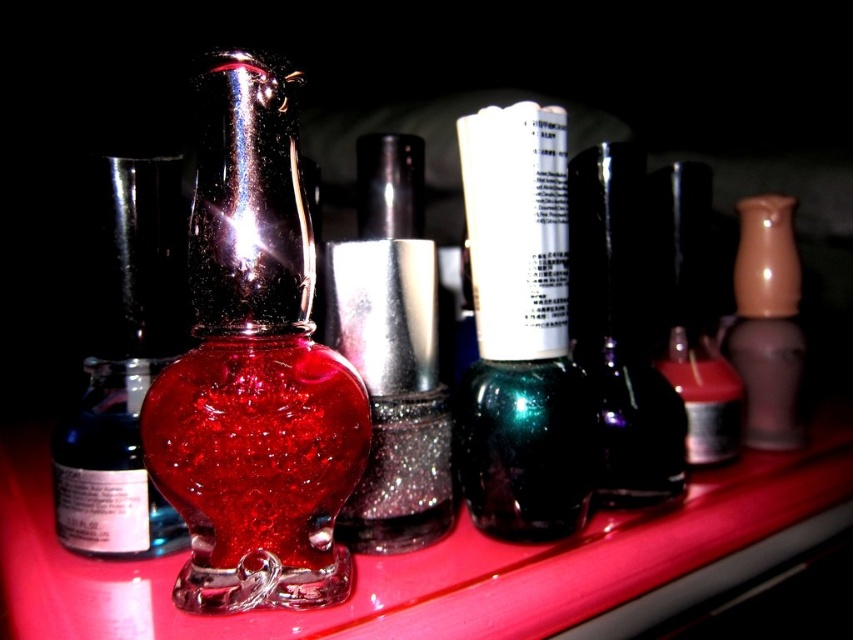
Can you confirm if sparkling glass bottle at center is wider than matte brown vase at right?

Yes.

Can you confirm if sparkling glass bottle at center is thinner than matte brown vase at right?

No.

Which is behind, point (213, 141) or point (735, 273)?

The point (735, 273) is behind.

Where is `sparkling glass bottle at center`? The height and width of the screenshot is (640, 853). sparkling glass bottle at center is located at coordinates (254, 365).

Can you confirm if shiny metallic nail polish at center is positioned to the left of matte black nail polish at center?

Correct, you'll find shiny metallic nail polish at center to the left of matte black nail polish at center.

Measure the distance from shiny metallic nail polish at center to matte black nail polish at center.

shiny metallic nail polish at center is 11.49 inches away from matte black nail polish at center.

Is point (410, 524) closer to viewer compared to point (738, 422)?

Yes, point (410, 524) is in front of point (738, 422).

This screenshot has width=853, height=640. In order to click on shiny metallic nail polish at center in this screenshot , I will do `click(392, 353)`.

Which is above, green metallic nail polish at center or matte brown vase at right?

matte brown vase at right

Can you confirm if green metallic nail polish at center is taller than matte brown vase at right?

Correct, green metallic nail polish at center is much taller as matte brown vase at right.

Identify the location of green metallic nail polish at center. The image size is (853, 640). (520, 332).

This screenshot has height=640, width=853. Identify the location of green metallic nail polish at center. (520, 332).